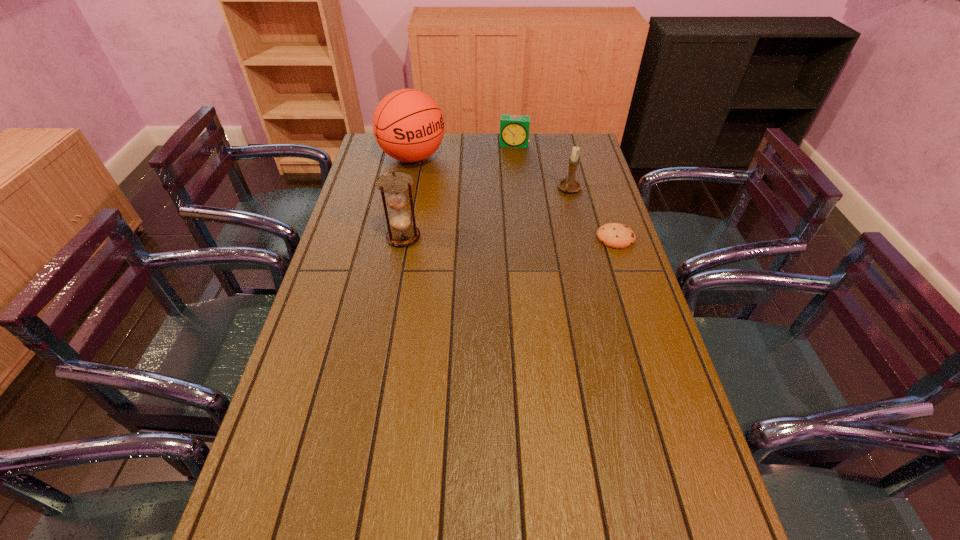
Image resolution: width=960 pixels, height=540 pixels. What are the coordinates of `free space located 0.320m on the side with logo of the basketball` in the screenshot? It's located at (481, 214).

At what (x,y) coordinates should I click in order to perform the action: click on vacant area situated on the side with logo of the basketball. Please return your answer as a coordinate pair (x, y). The height and width of the screenshot is (540, 960). Looking at the image, I should click on (441, 180).

Find the location of `free space located 0.250m on the side with logo of the basketball`. free space located 0.250m on the side with logo of the basketball is located at coordinates (468, 204).

At what (x,y) coordinates should I click in order to perform the action: click on free space located 0.220m on the side of the third nearest object with the handle. Please return your answer as a coordinate pair (x, y). The width and height of the screenshot is (960, 540). Looking at the image, I should click on (540, 232).

Locate an element on the screen. vacant space located 0.380m on the side of the third nearest object with the handle is located at coordinates (518, 261).

Locate an element on the screen. This screenshot has width=960, height=540. vacant space located 0.280m on the side of the third nearest object with the handle is located at coordinates (532, 242).

Locate an element on the screen. free space located on the front-facing side of the third object from right to left is located at coordinates (512, 158).

I want to click on vacant region located on the front-facing side of the third object from right to left, so click(x=506, y=199).

In order to click on vacant area situated on the front-facing side of the third object from right to left in this screenshot , I will do `click(510, 173)`.

Locate an element on the screen. The image size is (960, 540). basketball located at the far edge is located at coordinates (408, 125).